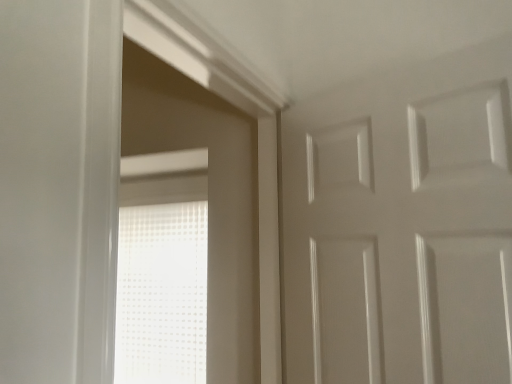
Question: Looking at the image, does white glossy door at upper right seem bigger or smaller compared to white frosted glass window at center?

Choices:
 (A) small
 (B) big

Answer: (B)

Question: Is white glossy door at upper right inside or outside of white frosted glass window at center?

Choices:
 (A) outside
 (B) inside

Answer: (A)

Question: Looking at their shapes, would you say white glossy door at upper right is wider or thinner than white frosted glass window at center?

Choices:
 (A) wide
 (B) thin

Answer: (A)

Question: Considering the positions of point (176, 223) and point (357, 301), is point (176, 223) closer or farther from the camera than point (357, 301)?

Choices:
 (A) closer
 (B) farther

Answer: (B)

Question: Considering the positions of white frosted glass window at center and white glossy door at upper right in the image, is white frosted glass window at center taller or shorter than white glossy door at upper right?

Choices:
 (A) short
 (B) tall

Answer: (B)

Question: From the image's perspective, is white frosted glass window at center located above or below white glossy door at upper right?

Choices:
 (A) above
 (B) below

Answer: (B)

Question: In terms of size, does white frosted glass window at center appear bigger or smaller than white glossy door at upper right?

Choices:
 (A) small
 (B) big

Answer: (A)